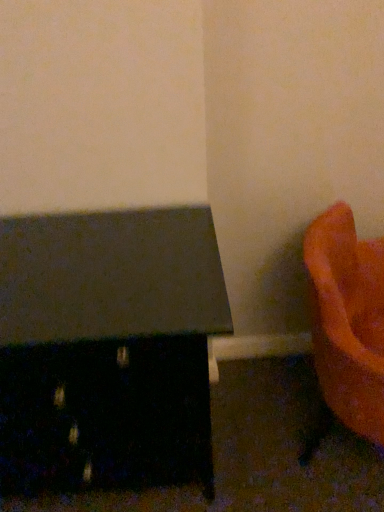
Question: Is orange matte vase at lower right, positioned as the first furniture in right-to-left order, outside of matte black table at left, which is the 2th furniture in right-to-left order?

Choices:
 (A) yes
 (B) no

Answer: (A)

Question: From the image's perspective, is orange matte vase at lower right, the second furniture from the left, above matte black table at left, which is the 2th furniture in right-to-left order?

Choices:
 (A) yes
 (B) no

Answer: (A)

Question: Considering the relative sizes of orange matte vase at lower right, the second furniture from the left, and matte black table at left, the first furniture in the left-to-right sequence, in the image provided, is orange matte vase at lower right, the second furniture from the left, shorter than matte black table at left, the first furniture in the left-to-right sequence,?

Choices:
 (A) no
 (B) yes

Answer: (B)

Question: Is orange matte vase at lower right, positioned as the first furniture in right-to-left order, bigger than matte black table at left, the first furniture in the left-to-right sequence?

Choices:
 (A) no
 (B) yes

Answer: (A)

Question: Is the position of orange matte vase at lower right, positioned as the first furniture in right-to-left order, less distant than that of matte black table at left, the first furniture in the left-to-right sequence?

Choices:
 (A) yes
 (B) no

Answer: (A)

Question: Can you confirm if orange matte vase at lower right, the second furniture from the left, is wider than matte black table at left, the first furniture in the left-to-right sequence?

Choices:
 (A) yes
 (B) no

Answer: (B)

Question: From the image's perspective, is matte black table at left, the first furniture in the left-to-right sequence, on orange matte vase at lower right, positioned as the first furniture in right-to-left order?

Choices:
 (A) no
 (B) yes

Answer: (A)

Question: Is matte black table at left, which is the 2th furniture in right-to-left order, placed right next to orange matte vase at lower right, positioned as the first furniture in right-to-left order?

Choices:
 (A) no
 (B) yes

Answer: (A)

Question: Is orange matte vase at lower right, the second furniture from the left, at the back of matte black table at left, the first furniture in the left-to-right sequence?

Choices:
 (A) no
 (B) yes

Answer: (A)

Question: Is matte black table at left, the first furniture in the left-to-right sequence, at the right side of orange matte vase at lower right, the second furniture from the left?

Choices:
 (A) no
 (B) yes

Answer: (A)

Question: Is matte black table at left, which is the 2th furniture in right-to-left order, shorter than orange matte vase at lower right, the second furniture from the left?

Choices:
 (A) yes
 (B) no

Answer: (B)

Question: Would you consider matte black table at left, the first furniture in the left-to-right sequence, to be distant from orange matte vase at lower right, the second furniture from the left?

Choices:
 (A) no
 (B) yes

Answer: (A)

Question: From the image's perspective, relative to matte black table at left, which is the 2th furniture in right-to-left order, is orange matte vase at lower right, positioned as the first furniture in right-to-left order, above or below?

Choices:
 (A) below
 (B) above

Answer: (B)